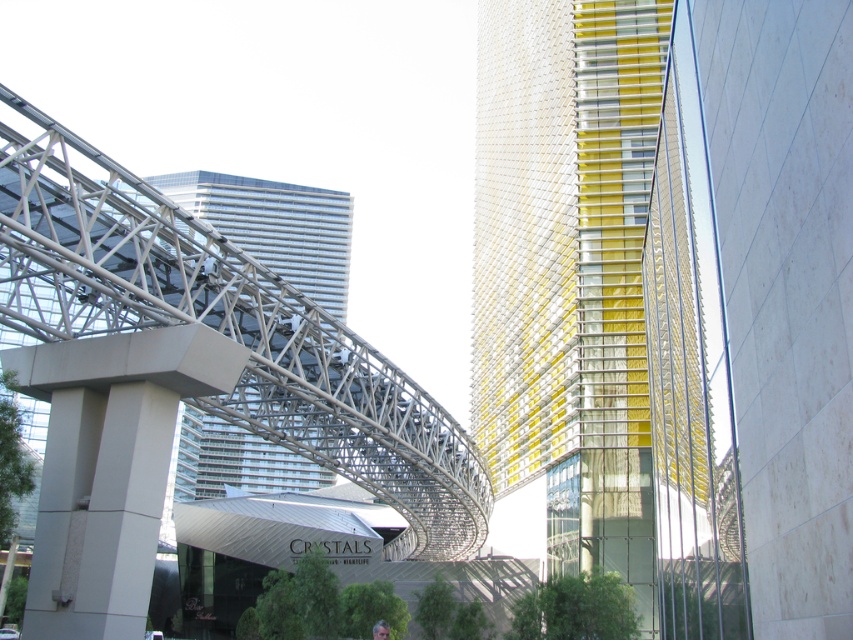
Question: From the image, what is the correct spatial relationship of yellow glass building at center in relation to gray concrete pillar at lower left?

Choices:
 (A) above
 (B) below

Answer: (A)

Question: Does metallic gray pedestrian bridge at center-left appear over glassy reflective skyscraper at center?

Choices:
 (A) yes
 (B) no

Answer: (B)

Question: Which object is closer to the camera taking this photo?

Choices:
 (A) gray concrete pillar at lower left
 (B) glassy reflective skyscraper at center
 (C) metallic gray pedestrian bridge at center-left
 (D) yellow glass building at center

Answer: (C)

Question: Among these objects, which one is farthest from the camera?

Choices:
 (A) yellow glass building at center
 (B) glassy reflective skyscraper at center
 (C) gray concrete pillar at lower left

Answer: (B)

Question: Based on their relative distances, which object is farther from the gray concrete pillar at lower left?

Choices:
 (A) metallic gray pedestrian bridge at center-left
 (B) glassy reflective skyscraper at center
 (C) yellow glass building at center

Answer: (B)

Question: Considering the relative positions of yellow glass building at center and metallic gray pedestrian bridge at center-left in the image provided, where is yellow glass building at center located with respect to metallic gray pedestrian bridge at center-left?

Choices:
 (A) below
 (B) above

Answer: (B)